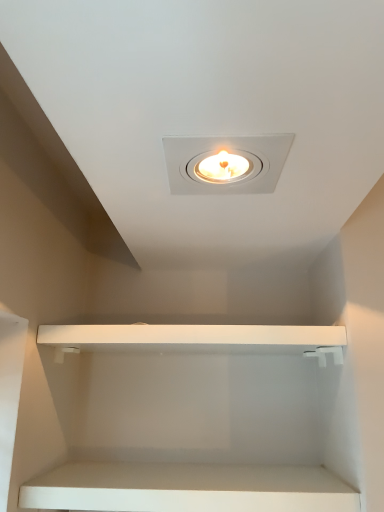
Where is `vacant space in white matte shelf at center, which ranks as the 2th cabinet in bottom-to-top order (from a real-world perspective)`? The height and width of the screenshot is (512, 384). vacant space in white matte shelf at center, which ranks as the 2th cabinet in bottom-to-top order (from a real-world perspective) is located at coordinates (191, 476).